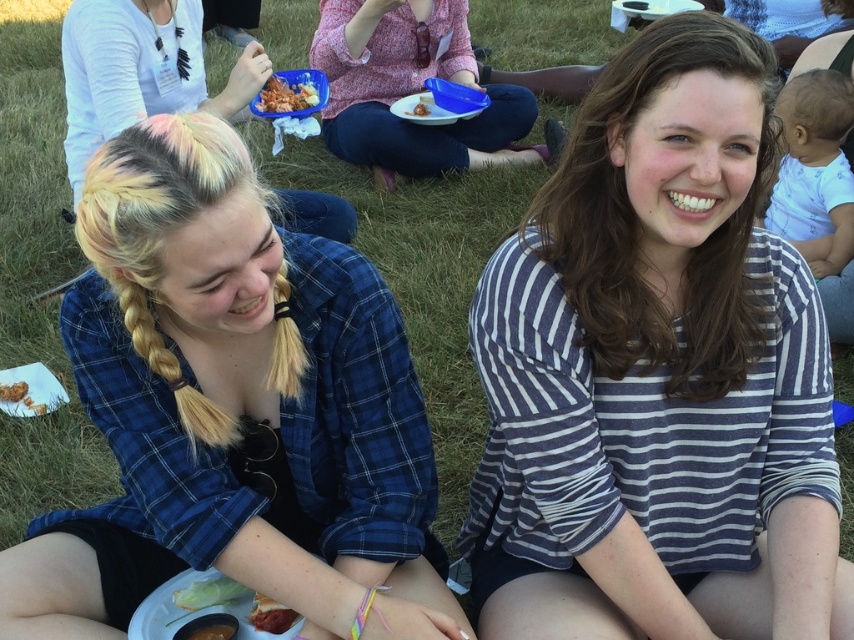
You are taking a photo of the two women in the scene. To ensure both are centered in the frame, which direction should you adjust the camera relative to the blonde hair at upper left?

Since the blonde hair at upper left is located at point 0.111 on the x and 0.165 on the y, you should move the camera slightly to the right and down to center both women in the frame.

Based on the photo, you are taking a photo of the scene and want to ensure both the blue plaid shirt at left and the striped navy and white long sleeve are visible. Based on their positions, which object is closer to the center of the image?

The blue plaid shirt at left is located at point (x=234, y=404), while the striped navy and white long sleeve is not specified in coordinates. Without exact coordinates for the striped navy and white long sleeve, it is impossible to determine which is closer to the center.